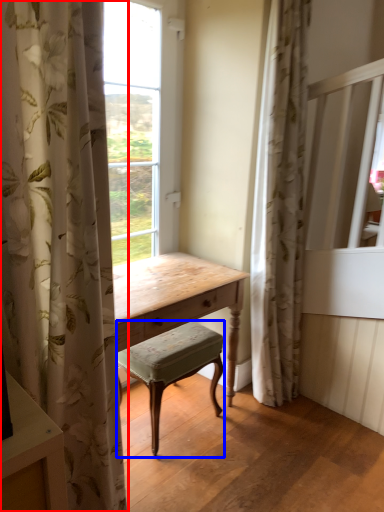
Question: Which object appears farthest to the camera in this image, curtain (highlighted by a red box) or stool (highlighted by a blue box)?

Choices:
 (A) curtain
 (B) stool

Answer: (B)